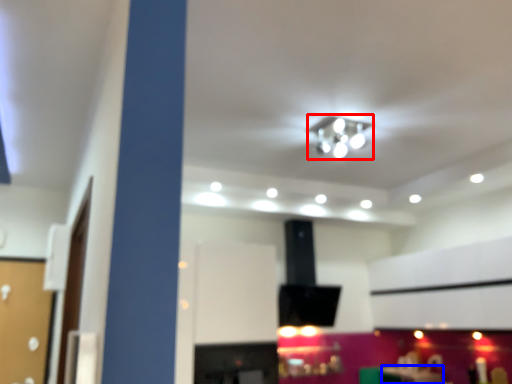
Question: Which object is further to the camera taking this photo, lamp (highlighted by a red box) or table (highlighted by a blue box)?

Choices:
 (A) lamp
 (B) table

Answer: (B)